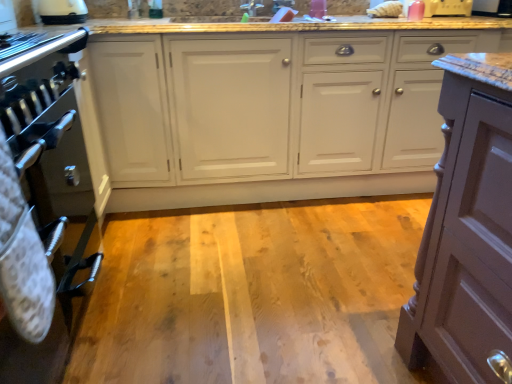
Question: Is metallic oven at left facing towards black glossy microwave at upper right, which is the second appliance from left to right?

Choices:
 (A) no
 (B) yes

Answer: (B)

Question: Would you consider metallic oven at left to be distant from black glossy microwave at upper right, the 1th appliance in the right-to-left sequence?

Choices:
 (A) yes
 (B) no

Answer: (A)

Question: Does metallic oven at left have a larger size compared to black glossy microwave at upper right, the 1th appliance in the right-to-left sequence?

Choices:
 (A) no
 (B) yes

Answer: (B)

Question: Can you confirm if metallic oven at left is taller than black glossy microwave at upper right, the 1th appliance in the right-to-left sequence?

Choices:
 (A) no
 (B) yes

Answer: (B)

Question: Considering the relative sizes of metallic oven at left and black glossy microwave at upper right, which is the second appliance from left to right, in the image provided, is metallic oven at left wider than black glossy microwave at upper right, which is the second appliance from left to right,?

Choices:
 (A) yes
 (B) no

Answer: (A)

Question: From a real-world perspective, is pink plastic toaster at upper right, the first appliance viewed from the left, positioned above or below white glossy kettle at upper left?

Choices:
 (A) below
 (B) above

Answer: (A)

Question: Considering the positions of pink plastic toaster at upper right, positioned as the 2th appliance in right-to-left order, and white glossy kettle at upper left in the image, is pink plastic toaster at upper right, positioned as the 2th appliance in right-to-left order, wider or thinner than white glossy kettle at upper left?

Choices:
 (A) wide
 (B) thin

Answer: (B)

Question: Based on their sizes in the image, would you say pink plastic toaster at upper right, the first appliance viewed from the left, is bigger or smaller than white glossy kettle at upper left?

Choices:
 (A) big
 (B) small

Answer: (A)

Question: From the image's perspective, is pink plastic toaster at upper right, positioned as the 2th appliance in right-to-left order, above or below white glossy kettle at upper left?

Choices:
 (A) below
 (B) above

Answer: (B)

Question: Is point (460, 1) closer or farther from the camera than point (48, 258)?

Choices:
 (A) farther
 (B) closer

Answer: (A)

Question: Considering their positions, is pink plastic toaster at upper right, positioned as the 2th appliance in right-to-left order, located in front of or behind metallic oven at left?

Choices:
 (A) behind
 (B) front

Answer: (A)

Question: In terms of width, does pink plastic toaster at upper right, positioned as the 2th appliance in right-to-left order, look wider or thinner when compared to metallic oven at left?

Choices:
 (A) thin
 (B) wide

Answer: (A)

Question: From a real-world perspective, is pink plastic toaster at upper right, the first appliance viewed from the left, positioned above or below metallic oven at left?

Choices:
 (A) below
 (B) above

Answer: (B)

Question: From the image's perspective, is black glossy microwave at upper right, which is the second appliance from left to right, above or below white glossy cabinets at center?

Choices:
 (A) below
 (B) above

Answer: (B)

Question: From a real-world perspective, relative to white glossy cabinets at center, is black glossy microwave at upper right, the 1th appliance in the right-to-left sequence, vertically above or below?

Choices:
 (A) above
 (B) below

Answer: (A)